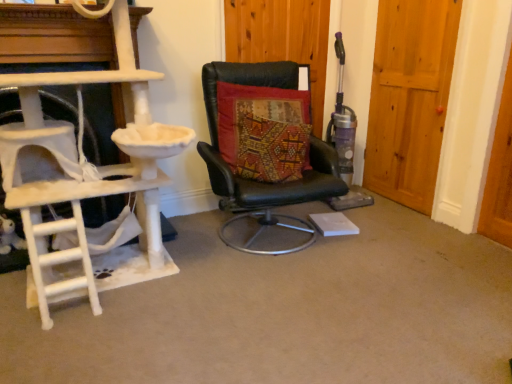
The width and height of the screenshot is (512, 384). I want to click on vacant area that lies to the right of white carpeted ladder at left, so click(248, 301).